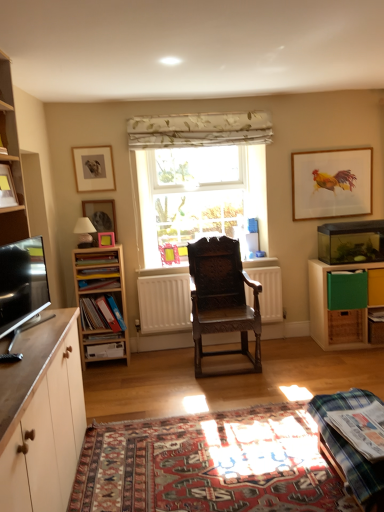
Locate an element on the screen. This screenshot has width=384, height=512. free point above watercolor paper rooster at upper right, the fourth picture frame positioned from the front (from a real-world perspective) is located at coordinates tap(342, 141).